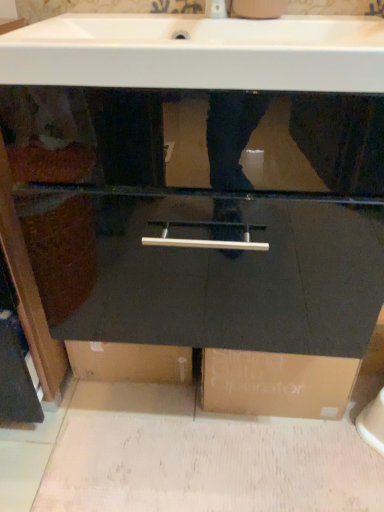
Question: Should I look upward or downward to see white glossy sink at upper center?

Choices:
 (A) down
 (B) up

Answer: (B)